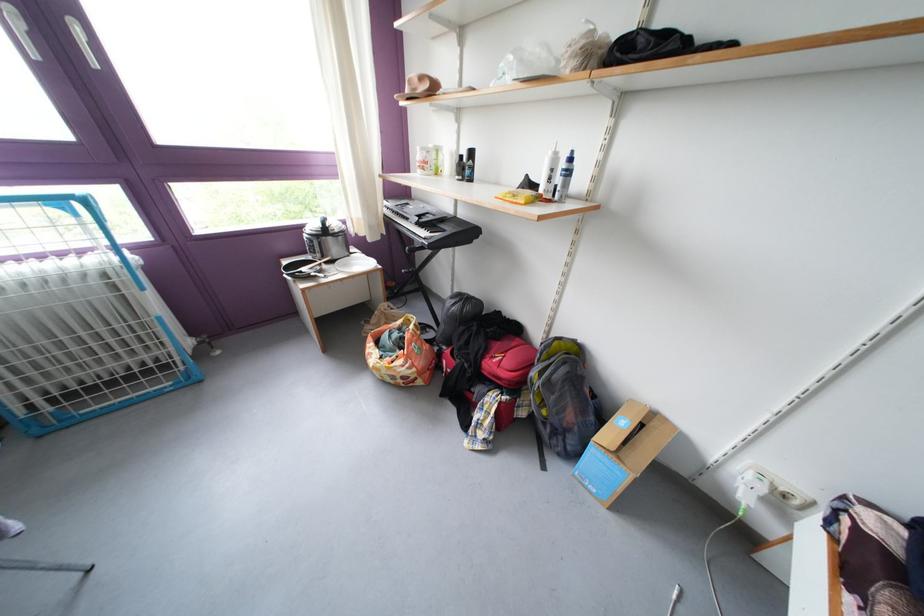
Find where to pull the white window handle. Please return your answer as a coordinate pair (x, y).

(81, 41)